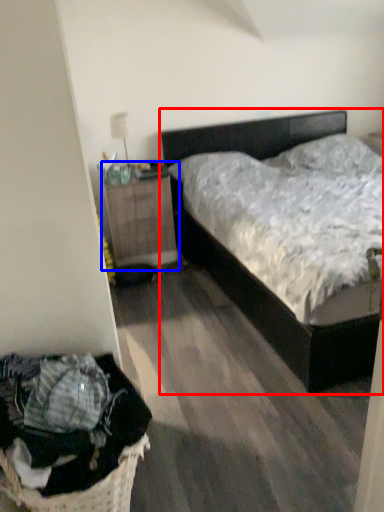
Question: Among these objects, which one is farthest to the camera, bed (highlighted by a red box) or nightstand (highlighted by a blue box)?

Choices:
 (A) bed
 (B) nightstand

Answer: (B)